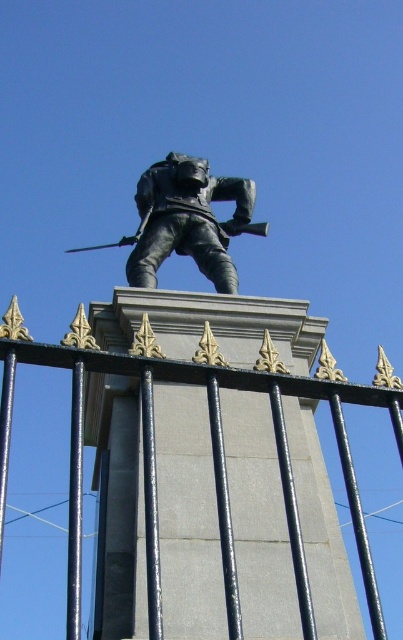
You are a painter standing at the edge of a park, wanting to capture the statue in your painting. You notice the black metal fence at center and the bronze statue at center. Which object should you focus on first if you want to paint the wider one?

The black metal fence at center might be wider than bronze statue at center, so you should focus on painting the black metal fence at center first.

You are a tour guide leading a group to the bronze statue at center. You notice a curious tourist trying to touch the black metal fence at center from where you are standing. Can you confirm if the tourist can reach the fence without moving closer?

The black metal fence at center and bronze statue at center are 59.95 feet apart. Since the tourist is at the bronze statue at center, they are 59.95 feet away from the fence. This distance is too far for the tourist to reach the fence without moving closer.

You are standing in front of the statue and want to take a photo of the bronze statue at center without including the black metal fence at center in the frame. Is it possible to do so based on their positions?

The black metal fence at center is below the bronze statue at center, so it is possible to take a photo of the bronze statue at center without including the black metal fence at center by angling the camera upwards to focus on the statue while avoiding the lower fence.